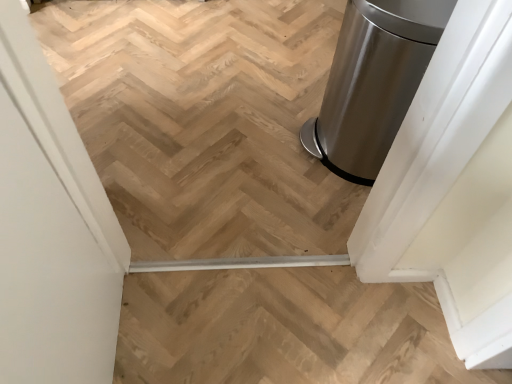
Question: Is white matte screen door at left closer to the viewer compared to satin metallic trash can at right?

Choices:
 (A) no
 (B) yes

Answer: (B)

Question: Is white matte screen door at left smaller than satin metallic trash can at right?

Choices:
 (A) yes
 (B) no

Answer: (B)

Question: From a real-world perspective, is white matte screen door at left physically below satin metallic trash can at right?

Choices:
 (A) no
 (B) yes

Answer: (A)

Question: Is white matte screen door at left at the left side of satin metallic trash can at right?

Choices:
 (A) no
 (B) yes

Answer: (B)

Question: From the image's perspective, is white matte screen door at left on satin metallic trash can at right?

Choices:
 (A) no
 (B) yes

Answer: (A)

Question: Is point (358, 112) closer or farther from the camera than point (317, 332)?

Choices:
 (A) closer
 (B) farther

Answer: (B)

Question: Is satin silver trash can at right inside or outside of natural wood stairs at center?

Choices:
 (A) inside
 (B) outside

Answer: (B)

Question: Based on their sizes in the image, would you say satin silver trash can at right is bigger or smaller than natural wood stairs at center?

Choices:
 (A) small
 (B) big

Answer: (B)

Question: From a real-world perspective, is satin silver trash can at right positioned above or below natural wood stairs at center?

Choices:
 (A) above
 (B) below

Answer: (A)

Question: Is white matte screen door at left to the left or to the right of satin metallic trash can at right in the image?

Choices:
 (A) right
 (B) left

Answer: (B)

Question: From the image's perspective, is white matte screen door at left positioned above or below satin metallic trash can at right?

Choices:
 (A) below
 (B) above

Answer: (A)

Question: From a real-world perspective, relative to satin metallic trash can at right, is white matte screen door at left vertically above or below?

Choices:
 (A) above
 (B) below

Answer: (A)

Question: Is point (20, 104) closer or farther from the camera than point (297, 163)?

Choices:
 (A) closer
 (B) farther

Answer: (A)

Question: Is natural wood stairs at center taller or shorter than satin silver trash can at right?

Choices:
 (A) short
 (B) tall

Answer: (A)

Question: Considering the positions of natural wood stairs at center and satin silver trash can at right in the image, is natural wood stairs at center bigger or smaller than satin silver trash can at right?

Choices:
 (A) big
 (B) small

Answer: (B)